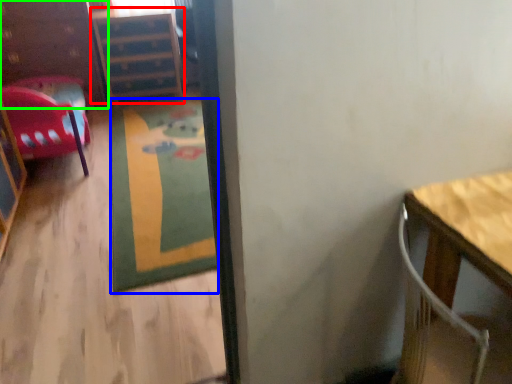
Question: Which is farther away from file cabinet (highlighted by a red box)? mat (highlighted by a blue box) or dresser (highlighted by a green box)?

Choices:
 (A) mat
 (B) dresser

Answer: (A)